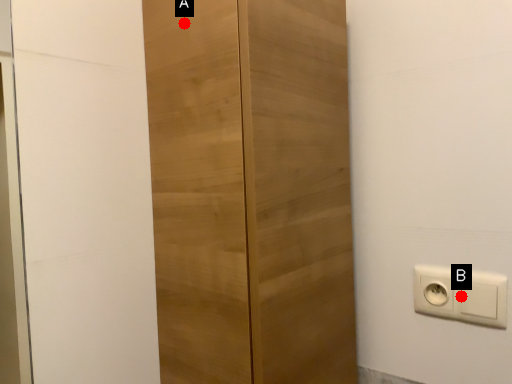
Question: Two points are circled on the image, labeled by A and B beside each circle. Which point is farther to the camera?

Choices:
 (A) A is further
 (B) B is further

Answer: (B)